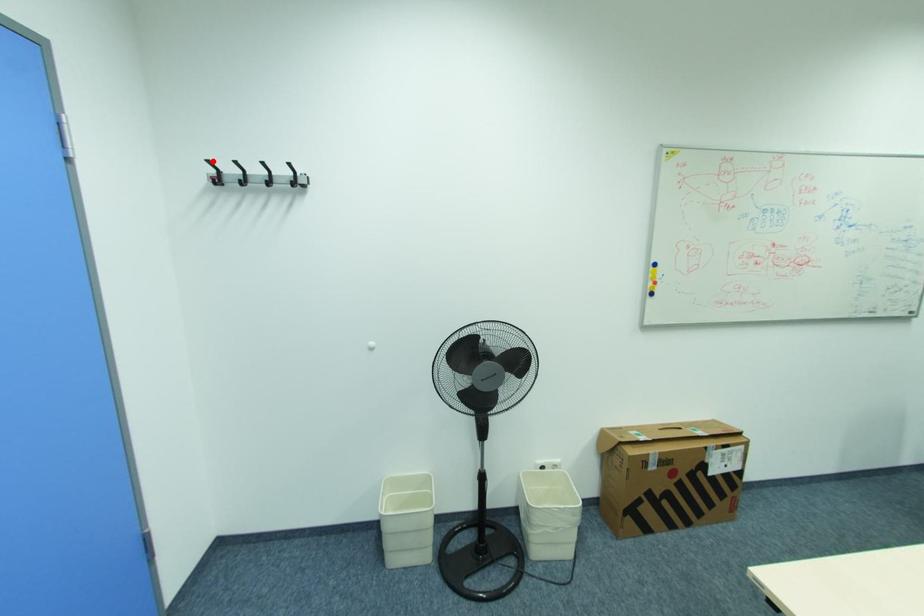
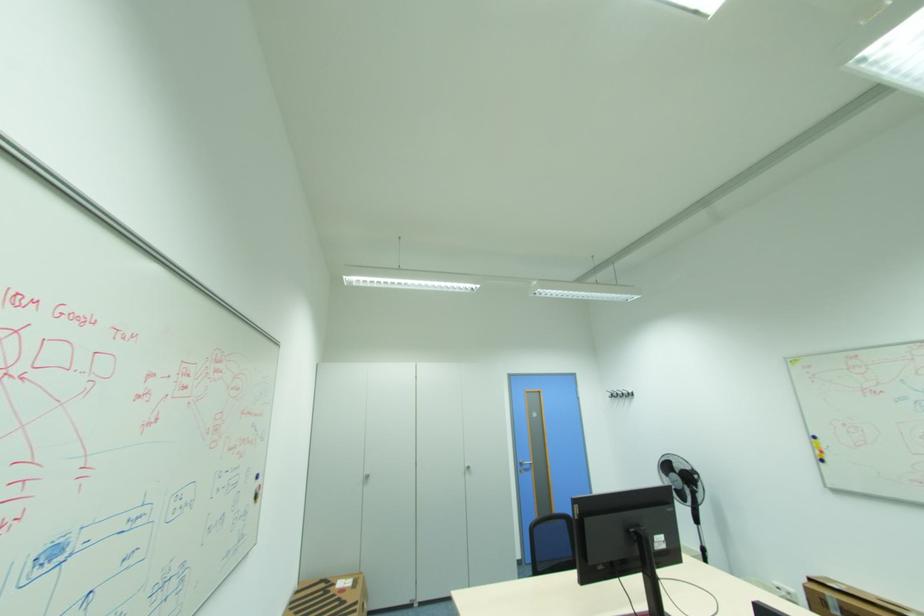
Find the pixel in the second image that matches the highlighted location in the first image.

(613, 391)